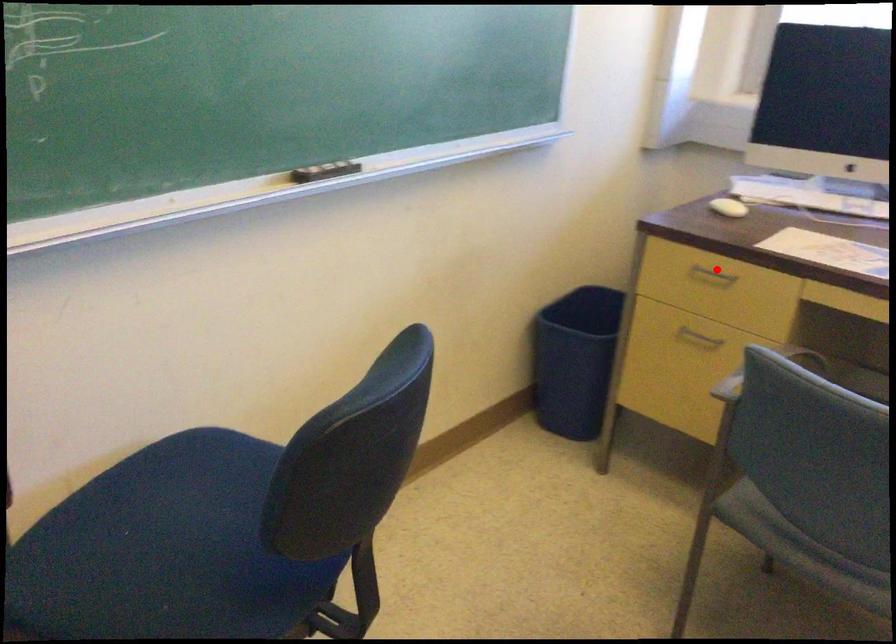
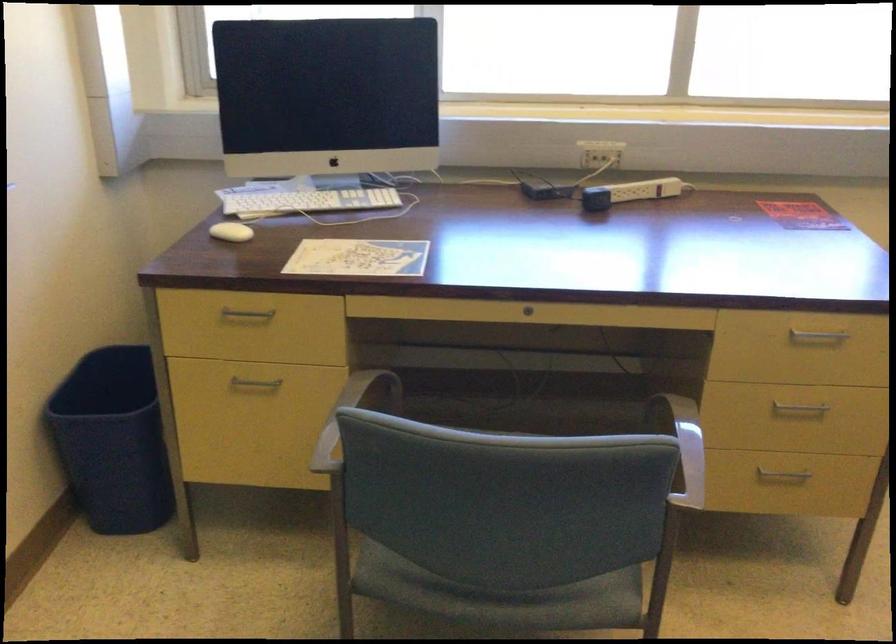
Question: I am providing you with two images of the same scene from different viewpoints. Given a red point in image1, look at the same physical point in image2. Is it:

Choices:
 (A) Closer to the viewpoint
 (B) Farther from the viewpoint

Answer: (A)